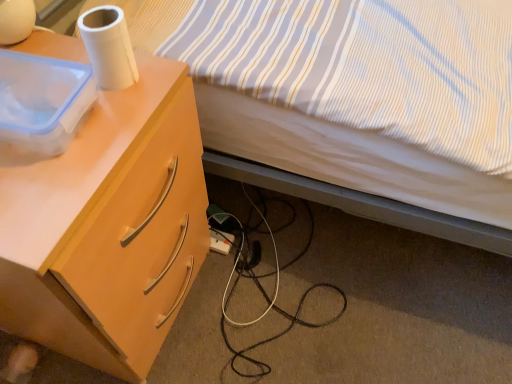
I want to click on vacant space situated above light wood/finish desk at left (from a real-world perspective), so click(x=80, y=114).